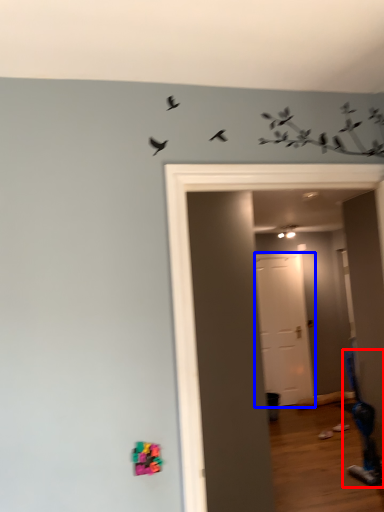
Question: Which object appears closest to the camera in this image, swivel chair (highlighted by a red box) or door (highlighted by a blue box)?

Choices:
 (A) swivel chair
 (B) door

Answer: (A)